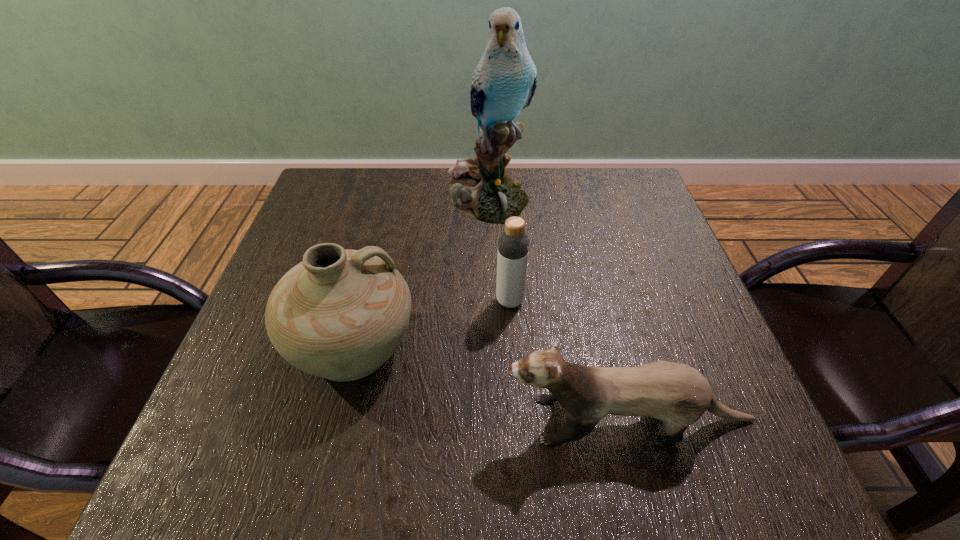
Image resolution: width=960 pixels, height=540 pixels. I want to click on empty space between the bottle and the pottery, so click(432, 323).

Identify the location of empty space between the pottery and the shortest object. [492, 383].

Locate which object is the closest to the bottle. Please provide its 2D coordinates. Your answer should be formatted as a tuple, i.e. [(x, y)], where the tuple contains the x and y coordinates of a point satisfying the conditions above.

[(340, 314)]

Where is `the closest object to the ferret`? Image resolution: width=960 pixels, height=540 pixels. the closest object to the ferret is located at coordinates (340, 314).

Locate an element on the screen. The height and width of the screenshot is (540, 960). vacant region that satisfies the following two spatial constraints: 1. on the face of the tallest object; 2. on the right side of the bottle is located at coordinates (490, 301).

This screenshot has height=540, width=960. I want to click on free space that satisfies the following two spatial constraints: 1. on the face of the tallest object; 2. on the right side of the bottle, so click(490, 301).